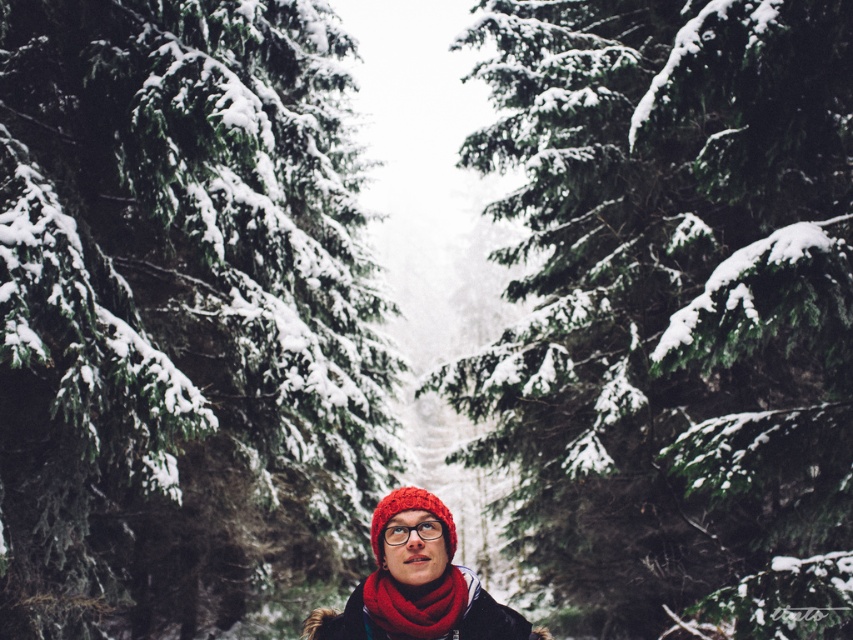
Question: Does snow-covered pine tree at center have a greater width compared to snow-covered evergreen at center?

Choices:
 (A) no
 (B) yes

Answer: (A)

Question: Is snow-covered pine tree at center wider than knitted wool scarf at center?

Choices:
 (A) yes
 (B) no

Answer: (A)

Question: Which point is farther to the camera?

Choices:
 (A) knitted woolen hat at center
 (B) knitted wool scarf at center
 (C) snow-covered evergreen at center
 (D) transparent plastic goggles at center

Answer: (C)

Question: Which object is closer to the camera taking this photo?

Choices:
 (A) knitted wool scarf at center
 (B) snow-covered pine tree at center
 (C) snow-covered evergreen at center

Answer: (A)

Question: In this image, where is snow-covered pine tree at center located relative to transparent plastic goggles at center?

Choices:
 (A) above
 (B) below

Answer: (A)

Question: Which point is closer to the camera?

Choices:
 (A) (440, 627)
 (B) (393, 532)
 (C) (444, 570)

Answer: (A)